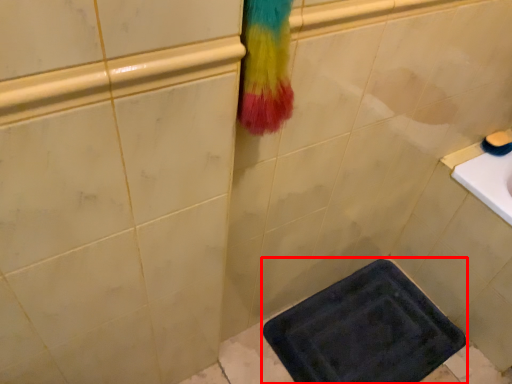
Question: Considering the relative positions of bath mat (annotated by the red box) and soap in the image provided, where is bath mat (annotated by the red box) located with respect to the staircase?

Choices:
 (A) left
 (B) right

Answer: (A)